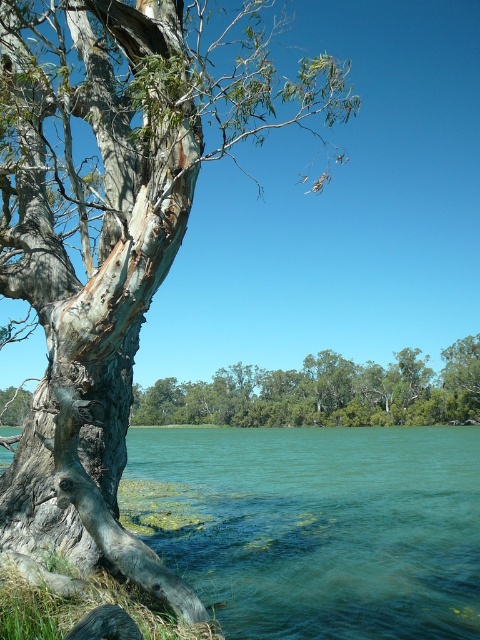
Can you confirm if gray bark tree at left is bigger than greenish water at lower left?

Yes.

Between point (169, 262) and point (432, 595), which one is positioned behind?

Point (432, 595)

What do you see at coordinates (115, 227) in the screenshot? This screenshot has width=480, height=640. I see `gray bark tree at left` at bounding box center [115, 227].

Find the location of a particular element. gray bark tree at left is located at coordinates (115, 227).

Which of these two, gray bark tree at left or green leafy trees at center, stands taller?

gray bark tree at left

This screenshot has width=480, height=640. What do you see at coordinates (115, 227) in the screenshot?
I see `gray bark tree at left` at bounding box center [115, 227].

Describe the element at coordinates (115, 227) in the screenshot. I see `gray bark tree at left` at that location.

The height and width of the screenshot is (640, 480). Find the location of `gray bark tree at left`. gray bark tree at left is located at coordinates (115, 227).

The width and height of the screenshot is (480, 640). What do you see at coordinates (315, 525) in the screenshot? I see `greenish water at lower left` at bounding box center [315, 525].

The width and height of the screenshot is (480, 640). Identify the location of greenish water at lower left. (315, 525).

Locate an element on the screen. This screenshot has height=640, width=480. greenish water at lower left is located at coordinates (315, 525).